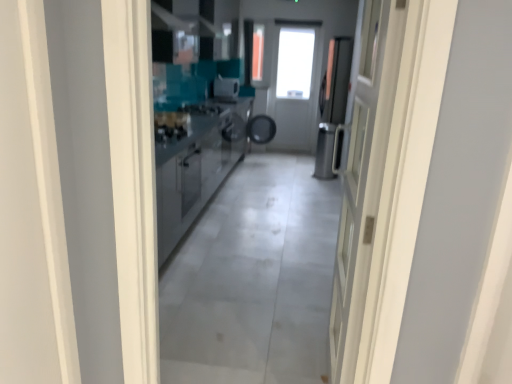
Identify the location of free location to the left of white glossy door at right. The height and width of the screenshot is (384, 512). (245, 350).